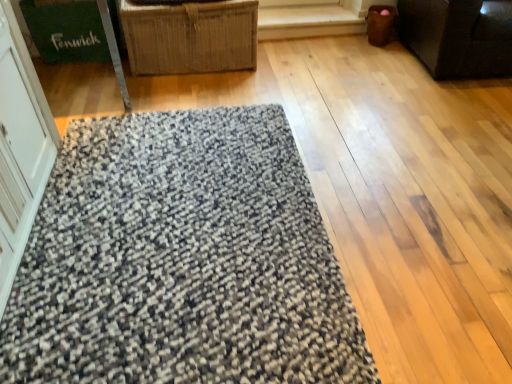
Locate an element on the screen. vacant area located to the right-hand side of woven straw basket at upper center, which is counted as the first furniture, starting from the left is located at coordinates (289, 72).